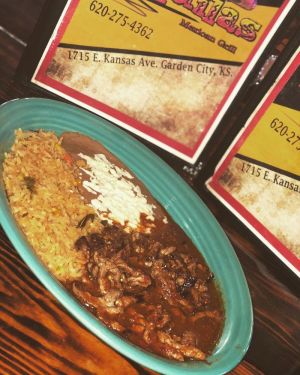
Identify the location of bowl. This screenshot has height=375, width=300. (210, 238).